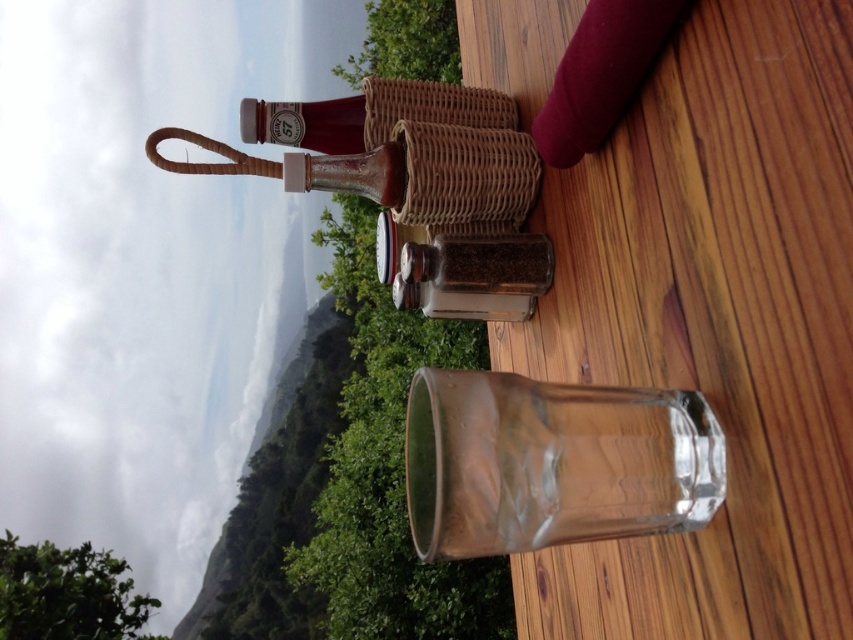
Question: Does translucent glass bottle at upper center appear on the right side of translucent glass bottle at center?

Choices:
 (A) no
 (B) yes

Answer: (A)

Question: Does transparent glass at center appear under translucent glass bottle at center?

Choices:
 (A) yes
 (B) no

Answer: (A)

Question: Considering the real-world distances, which object is closest to the transparent glass at center?

Choices:
 (A) translucent glass bottle at center
 (B) translucent glass bottle at upper center

Answer: (A)

Question: Which point is closer to the camera taking this photo?

Choices:
 (A) (292, 168)
 (B) (349, 124)
 (C) (618, 394)

Answer: (C)

Question: Does transparent glass at center appear over clear glass shaker at center?

Choices:
 (A) no
 (B) yes

Answer: (A)

Question: Which point appears farthest from the camera in this image?

Choices:
 (A) (358, 129)
 (B) (286, 163)

Answer: (A)